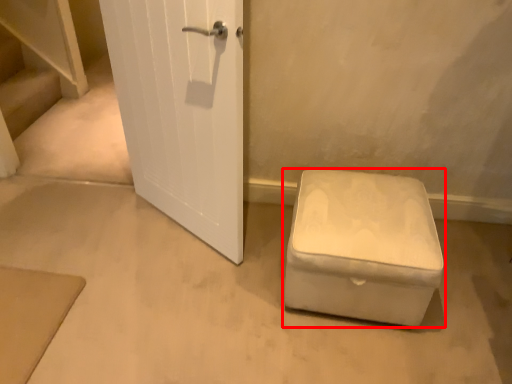
Question: From the image's perspective, what is the correct spatial relationship of furniture (annotated by the red box) in relation to stairwell?

Choices:
 (A) below
 (B) above

Answer: (A)